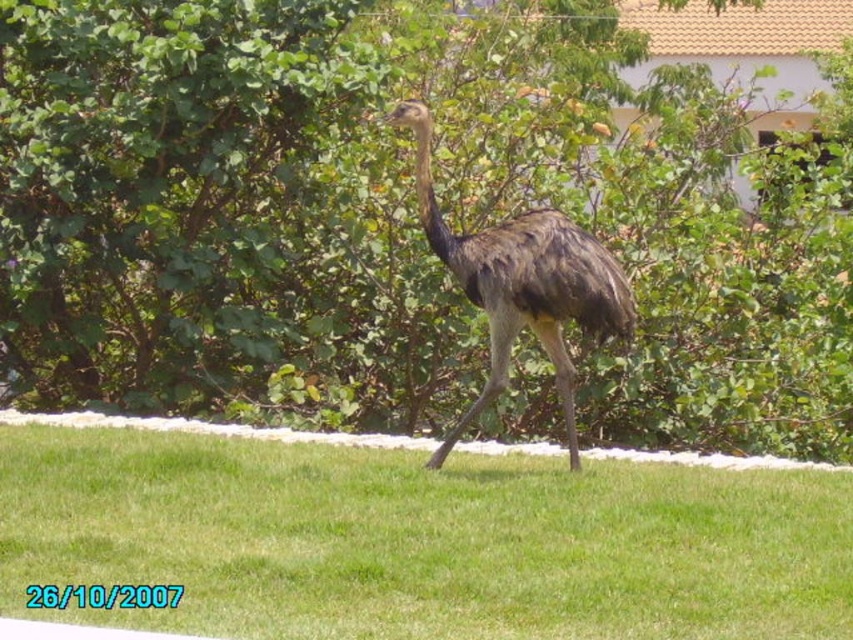
You are a photographer trying to capture the brown feathered ostrich at center in your shot. The green grass at center is blocking part of the ostrich. How can you adjust your position to ensure the ostrich is fully visible?

Since the green grass at center is larger in size than the brown feathered ostrich at center, you should move your camera position to a higher angle to avoid the grass blocking the ostrich.

You are standing in the grassy area and want to take a photo of the brown feathered ostrich at center without the green leafy tree at center blocking the view. Is the ostrich visible from your current position?

The green leafy tree at center is positioned over the brown feathered ostrich at center, so the tree is blocking the view of the ostrich. You will not be able to take a clear photo of the brown feathered ostrich at center without the tree blocking it.